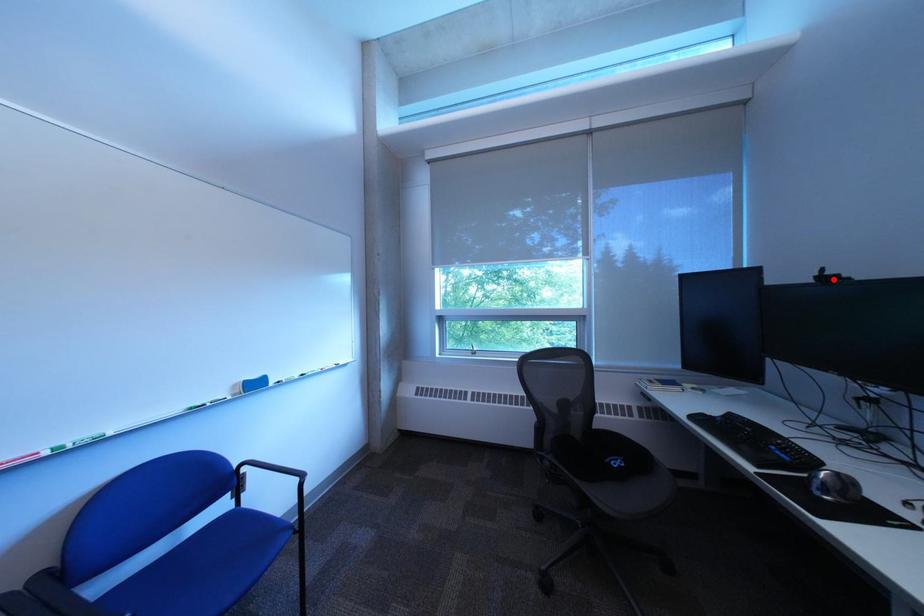
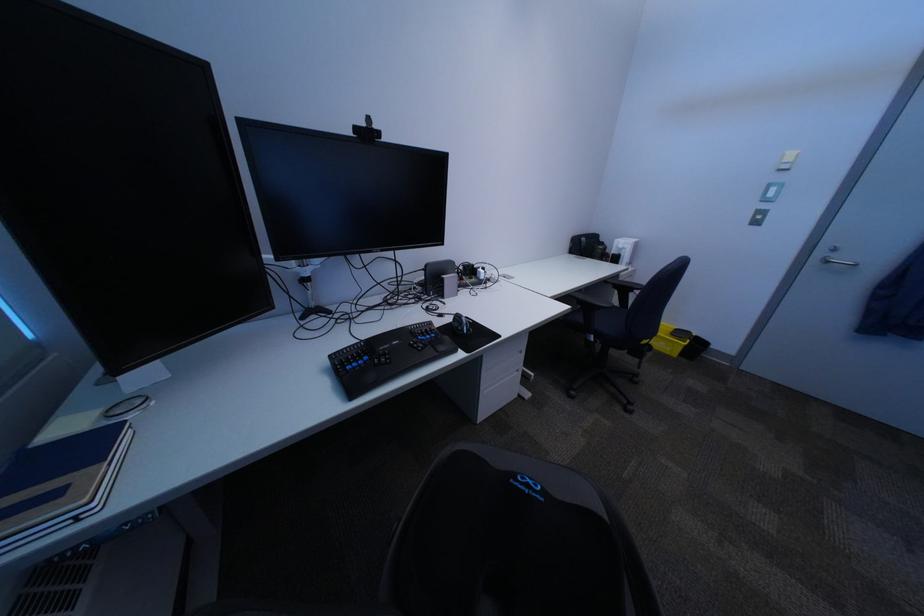
Where in the second image is the point corresponding to the highlighted location from the first image?

(371, 131)